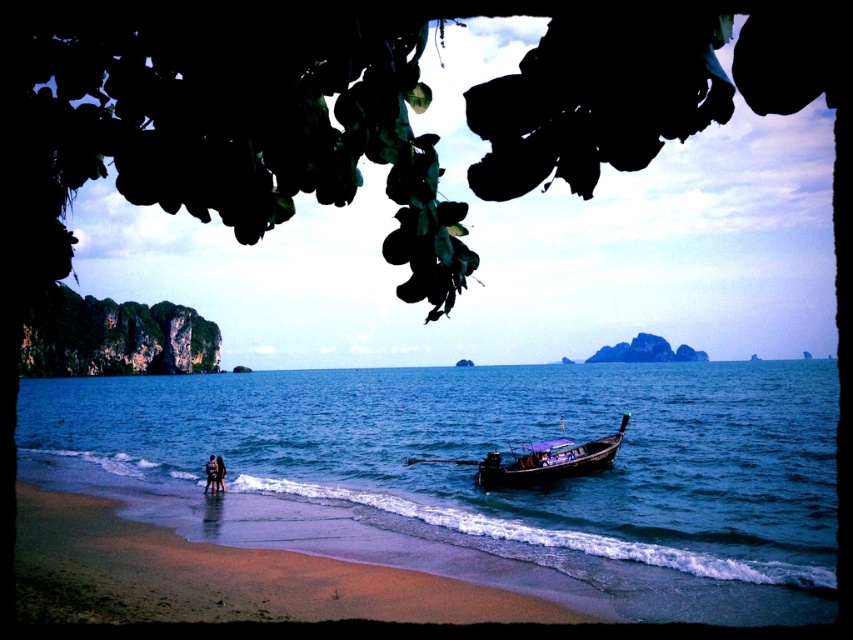
Which is more to the right, sandy beach at lower left or green leafy rock at upper left?

Positioned to the right is sandy beach at lower left.

What do you see at coordinates (222, 577) in the screenshot?
I see `sandy beach at lower left` at bounding box center [222, 577].

Where is `sandy beach at lower left`? sandy beach at lower left is located at coordinates (222, 577).

The image size is (853, 640). I want to click on sandy beach at lower left, so click(222, 577).

Between point (97, 344) and point (207, 474), which one is positioned in front?

Positioned in front is point (207, 474).

Locate an element on the screen. Image resolution: width=853 pixels, height=640 pixels. green leafy rock at upper left is located at coordinates (115, 337).

Between blue water at lower center and sandy beach at lower left, which one has less height?

With less height is sandy beach at lower left.

From the picture: Who is taller, blue water at lower center or sandy beach at lower left?

Answer: blue water at lower center

This screenshot has height=640, width=853. Describe the element at coordinates (474, 470) in the screenshot. I see `blue water at lower center` at that location.

Locate an element on the screen. This screenshot has height=640, width=853. blue water at lower center is located at coordinates (474, 470).